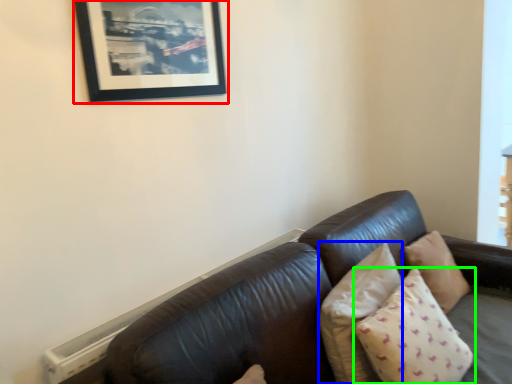
Question: Which object is positioned farthest from picture frame (highlighted by a red box)? Select from pillow (highlighted by a blue box) and pillow (highlighted by a green box).

Choices:
 (A) pillow
 (B) pillow

Answer: (B)